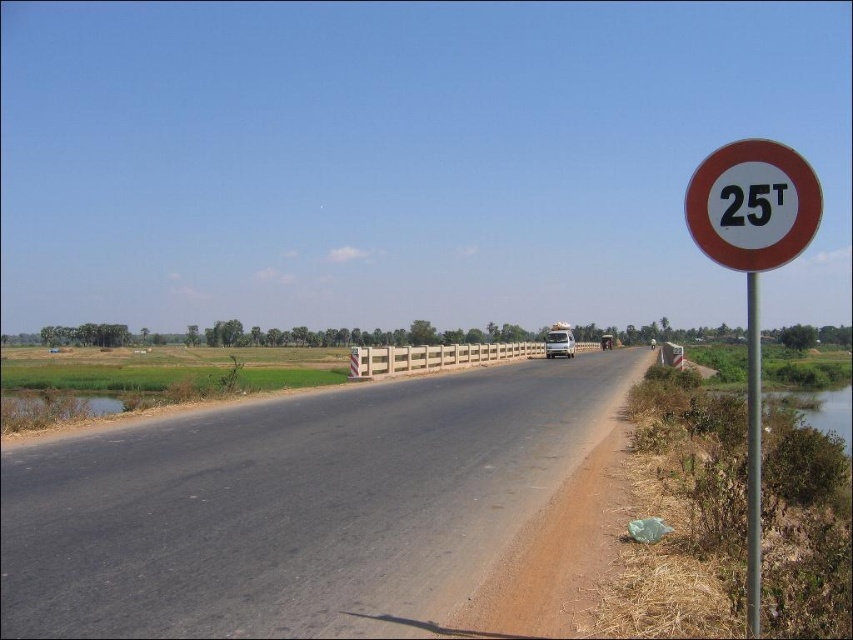
Question: Among these objects, which one is nearest to the camera?

Choices:
 (A) black asphalt road at center
 (B) white plastic pole at right
 (C) white circular sign at right

Answer: (B)

Question: Is white plastic sign at right to the left of white matte trailer truck at center from the viewer's perspective?

Choices:
 (A) no
 (B) yes

Answer: (A)

Question: Which point is farther from the camera taking this photo?

Choices:
 (A) (556, 353)
 (B) (183, 618)

Answer: (A)

Question: Is black asphalt road at center bigger than white plastic sign at right?

Choices:
 (A) no
 (B) yes

Answer: (A)

Question: Can you confirm if black asphalt road at center is thinner than white circular sign at right?

Choices:
 (A) yes
 (B) no

Answer: (B)

Question: Which of these objects is positioned closest to the white matte trailer truck at center?

Choices:
 (A) black asphalt road at center
 (B) white plastic sign at right
 (C) white plastic pole at right
 (D) white circular sign at right

Answer: (C)